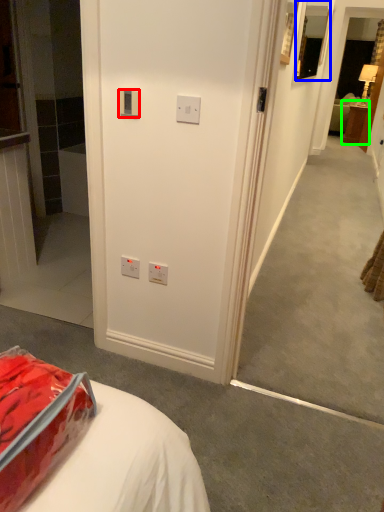
Question: Considering the real-world distances, which object is farthest from electric outlet (highlighted by a red box)? picture frame (highlighted by a blue box) or furniture (highlighted by a green box)?

Choices:
 (A) picture frame
 (B) furniture

Answer: (B)